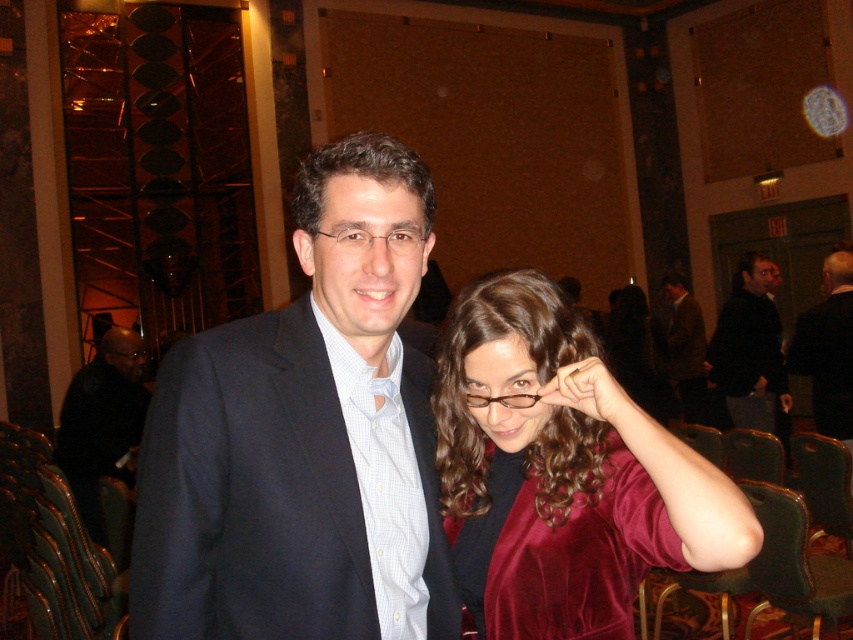
Question: Can you confirm if matte black suit at center is wider than dark suit at center?

Choices:
 (A) no
 (B) yes

Answer: (B)

Question: Is black matte suit at left thinner than black leather jacket at right?

Choices:
 (A) no
 (B) yes

Answer: (B)

Question: Which object is positioned closest to the dark brown suit at center?

Choices:
 (A) velvet burgundy blouse at right
 (B) black matte suit at left

Answer: (B)

Question: Which object is closer to the camera taking this photo?

Choices:
 (A) clear plastic glasses at center
 (B) matte black suit at center
 (C) dark suit at center
 (D) black matte suit at left

Answer: (B)

Question: Which point is closer to the camera?

Choices:
 (A) matte black glasses at upper center
 (B) velvet maroon dress at center
 (C) dark suit at center

Answer: (B)

Question: Does black matte suit at left appear on the right side of clear plastic glasses at center?

Choices:
 (A) no
 (B) yes

Answer: (A)